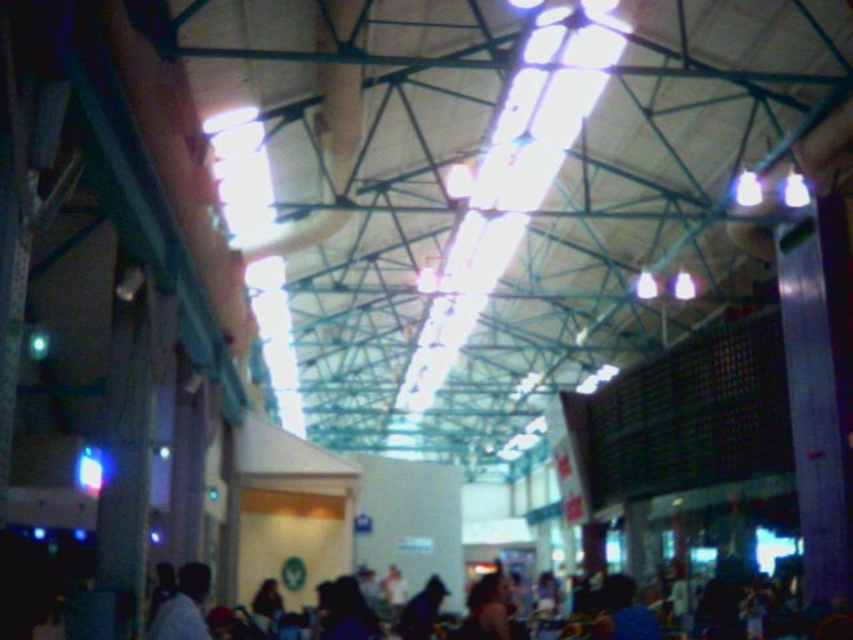
Is point (160, 612) closer to camera compared to point (496, 625)?

Yes, it is in front of point (496, 625).

Where is `blue fabric shirt at lower left`? The width and height of the screenshot is (853, 640). blue fabric shirt at lower left is located at coordinates (x=183, y=605).

Locate an element on the screen. The width and height of the screenshot is (853, 640). blue fabric shirt at lower left is located at coordinates (183, 605).

Find the location of a particular element. blue fabric shirt at lower left is located at coordinates (183, 605).